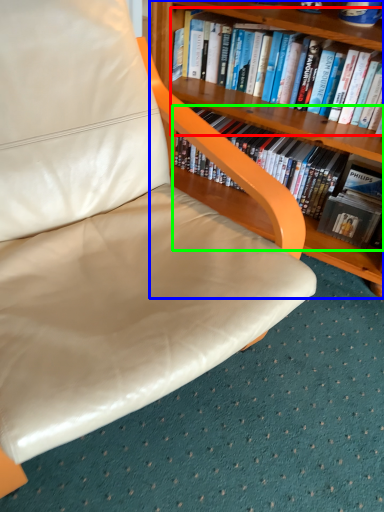
Question: Which is farther away from book (highlighted by a red box)? bookcase (highlighted by a blue box) or book (highlighted by a green box)?

Choices:
 (A) bookcase
 (B) book

Answer: (B)